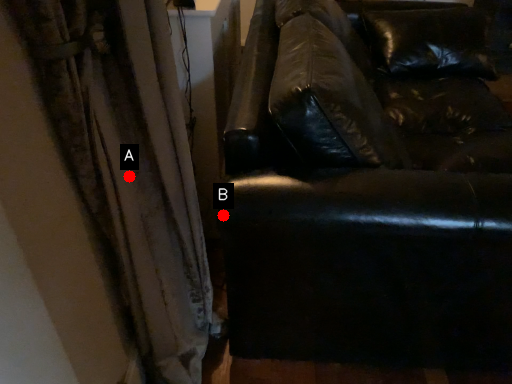
Question: Two points are circled on the image, labeled by A and B beside each circle. Which point is farther to the camera?

Choices:
 (A) A is further
 (B) B is further

Answer: (B)